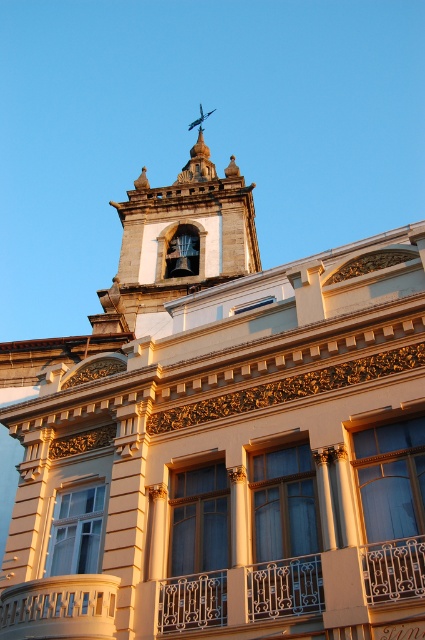
Question: Where is gold wrought iron balcony at center located in relation to dark gray stone bell tower at upper center in the image?

Choices:
 (A) below
 (B) above

Answer: (A)

Question: Which object appears closest to the camera in this image?

Choices:
 (A) dark gray stone bell tower at upper center
 (B) gold wrought iron balcony at center

Answer: (B)

Question: Is the position of gold wrought iron balcony at center more distant than that of dark gray stone bell tower at upper center?

Choices:
 (A) no
 (B) yes

Answer: (A)

Question: Which point appears closest to the camera in this image?

Choices:
 (A) (136, 636)
 (B) (248, 214)

Answer: (A)

Question: Does gold wrought iron balcony at center have a larger size compared to dark gray stone bell tower at upper center?

Choices:
 (A) yes
 (B) no

Answer: (B)